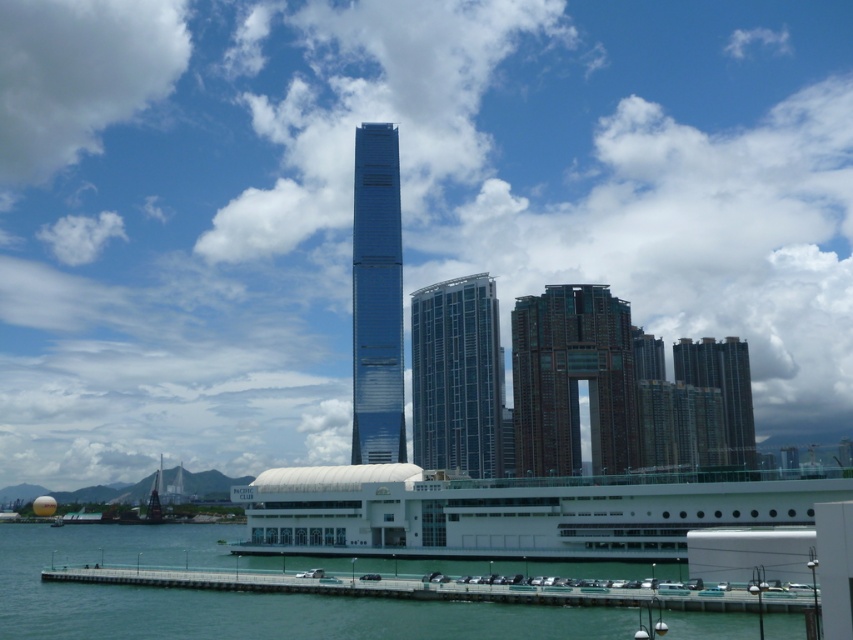
You are an architect designing a new building and want to ensure it doesn not block the view of the glassy blue skyscraper at center from the white fluffy cloud at upper left. Given their sizes and positions, is this feasible?

The white fluffy cloud at upper left is larger in size compared to the glassy blue skyscraper at center. Since the cloud is positioned at the upper left and the skyscraper is at the center, the cloud would not block the view of the skyscraper because the cloud is both larger and located above it, allowing the skyscraper to remain visible below the cloud.

You are a delivery drone with a maximum flight range of 120 meters. You need to deliver a package from the glossy glass tower at center to the smooth concrete dock at lower center. Can you complete the delivery without needing to recharge?

The glossy glass tower at center and smooth concrete dock at lower center are 113.90 meters apart from each other. Since the distance is less than the drone maximum flight range of 120 meters, the delivery can be completed without recharging.